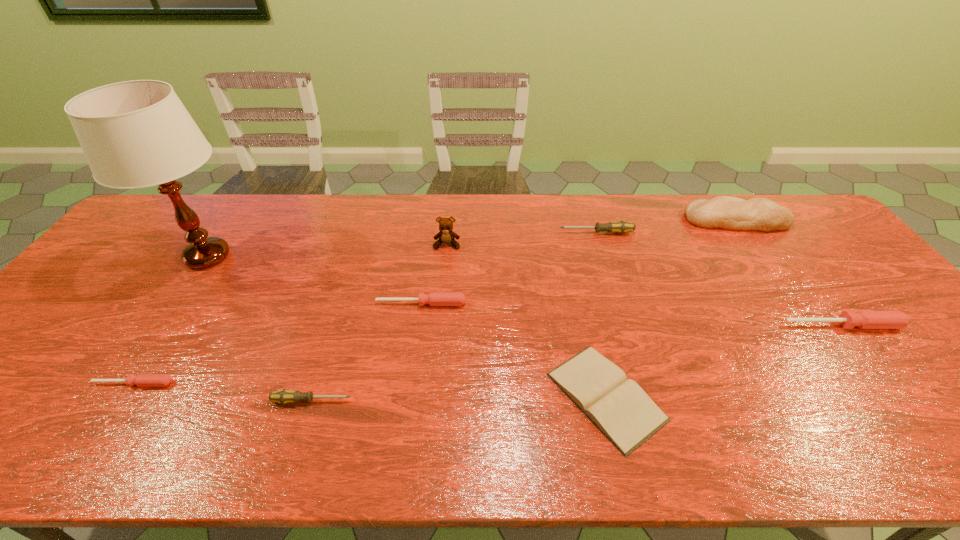
Where is `free space located 0.360m at the tip of the right gray screwdriver`? free space located 0.360m at the tip of the right gray screwdriver is located at coordinates (446, 233).

Identify the location of free space located at the tip of the right gray screwdriver. This screenshot has height=540, width=960. pos(474,233).

Where is `vacant area situated on the front of the second nearest red screwdriver`? vacant area situated on the front of the second nearest red screwdriver is located at coordinates (872, 364).

Identify the location of free space located on the left of the fourth nearest screwdriver. The image size is (960, 540). (280, 303).

At what (x,y) coordinates should I click in order to perform the action: click on free space located at the tip of the smaller gray screwdriver. Please return your answer as a coordinate pair (x, y). This screenshot has height=540, width=960. Looking at the image, I should click on (506, 401).

What are the coordinates of `vacant space situated 0.080m on the left of the leftmost red screwdriver` in the screenshot? It's located at (60, 383).

You are a GUI agent. You are given a task and a screenshot of the screen. Output one action in this format:
    pyautogui.click(x=<x>, y=<y>)
    Task: Click on the vacant space located 0.370m on the right of the Bible
    This screenshot has height=540, width=960.
    Given the screenshot: What is the action you would take?
    pyautogui.click(x=828, y=396)

Find the location of a particular element. table lamp located in the far edge section of the desktop is located at coordinates (134, 134).

In order to click on teddy bear situated at the far edge in this screenshot , I will do `click(446, 235)`.

Image resolution: width=960 pixels, height=540 pixels. What are the coordinates of `bread that is at the far edge` in the screenshot? It's located at (727, 212).